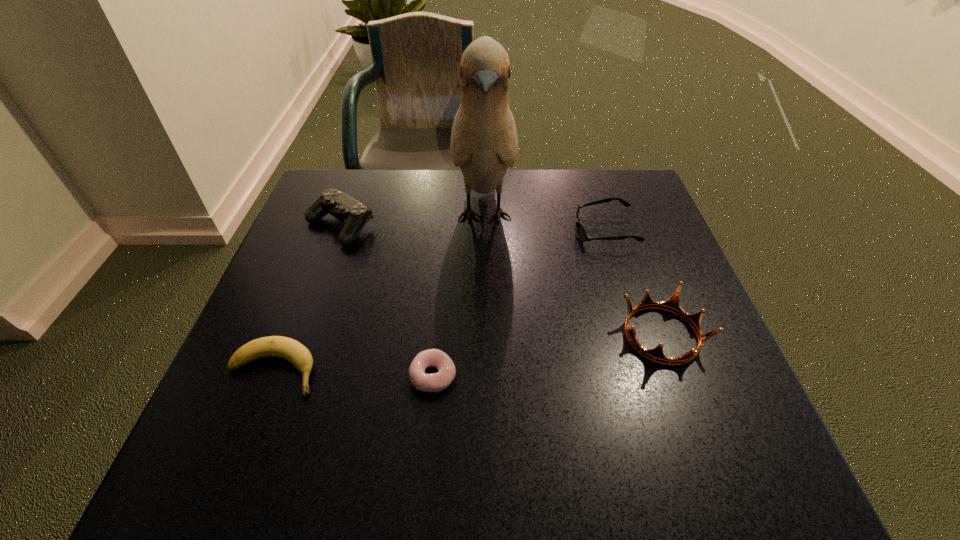
Locate an element on the screen. The image size is (960, 540). sunglasses that is at the right edge is located at coordinates (582, 234).

At what (x,y) coordinates should I click in order to perform the action: click on object positioned at the far left corner. Please return your answer as a coordinate pair (x, y). The width and height of the screenshot is (960, 540). Looking at the image, I should click on (354, 214).

Where is `object situated at the far right corner`? Image resolution: width=960 pixels, height=540 pixels. object situated at the far right corner is located at coordinates (582, 234).

At what (x,y) coordinates should I click in order to perform the action: click on vacant space at the far edge. Please return your answer as a coordinate pair (x, y). The width and height of the screenshot is (960, 540). Looking at the image, I should click on (398, 181).

Locate an element on the screen. The width and height of the screenshot is (960, 540). vacant area at the near edge of the desktop is located at coordinates (637, 484).

Identify the location of vacant space at the left edge of the desktop. This screenshot has height=540, width=960. (241, 379).

Where is `vacant space at the right edge of the desktop`? vacant space at the right edge of the desktop is located at coordinates (680, 426).

Find the location of a particular element. free spot at the far left corner of the desktop is located at coordinates (361, 178).

Locate an element on the screen. This screenshot has width=960, height=540. free space at the near left corner of the desktop is located at coordinates (200, 463).

Find the location of a particular element. The width and height of the screenshot is (960, 540). vacant region at the far right corner is located at coordinates (645, 206).